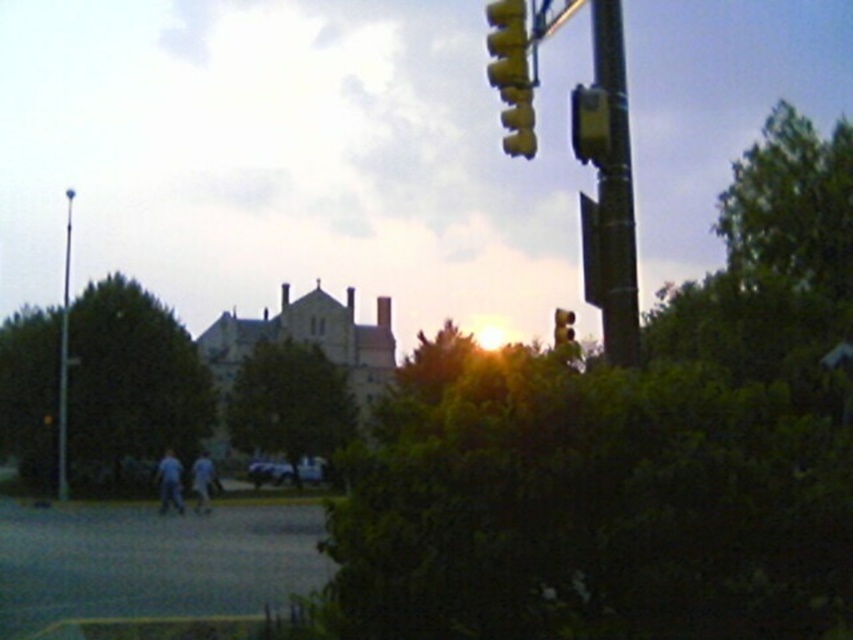
Measure the distance between green leafy tree at left and camera.

A distance of 124.12 feet exists between green leafy tree at left and camera.

Between green leafy tree at left and silver metallic pole at left, which one appears on the left side from the viewer's perspective?

silver metallic pole at left

The height and width of the screenshot is (640, 853). I want to click on green leafy tree at left, so click(132, 378).

Who is positioned more to the right, light blue jeans at lower left or blue jeans at lower left?

From the viewer's perspective, blue jeans at lower left appears more on the right side.

Between light blue jeans at lower left and blue jeans at lower left, which one has less height?

Standing shorter between the two is blue jeans at lower left.

The image size is (853, 640). Describe the element at coordinates (169, 483) in the screenshot. I see `light blue jeans at lower left` at that location.

Where is `light blue jeans at lower left`? This screenshot has height=640, width=853. light blue jeans at lower left is located at coordinates (169, 483).

Between green leafy tree at center and silver metallic pole at left, which one is positioned lower?

Positioned lower is green leafy tree at center.

Consider the image. Can you confirm if green leafy tree at center is bigger than silver metallic pole at left?

Actually, green leafy tree at center might be smaller than silver metallic pole at left.

At what (x,y) coordinates should I click in order to perform the action: click on green leafy tree at center. Please return your answer as a coordinate pair (x, y). The image size is (853, 640). Looking at the image, I should click on (289, 403).